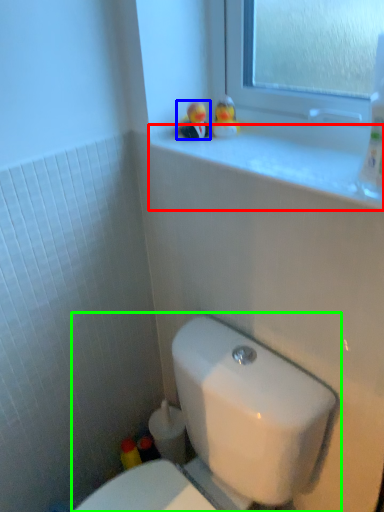
Question: Considering the real-world distances, which object is closest to window sill (highlighted by a red box)? miniature (highlighted by a blue box) or toilet (highlighted by a green box).

Choices:
 (A) miniature
 (B) toilet

Answer: (A)